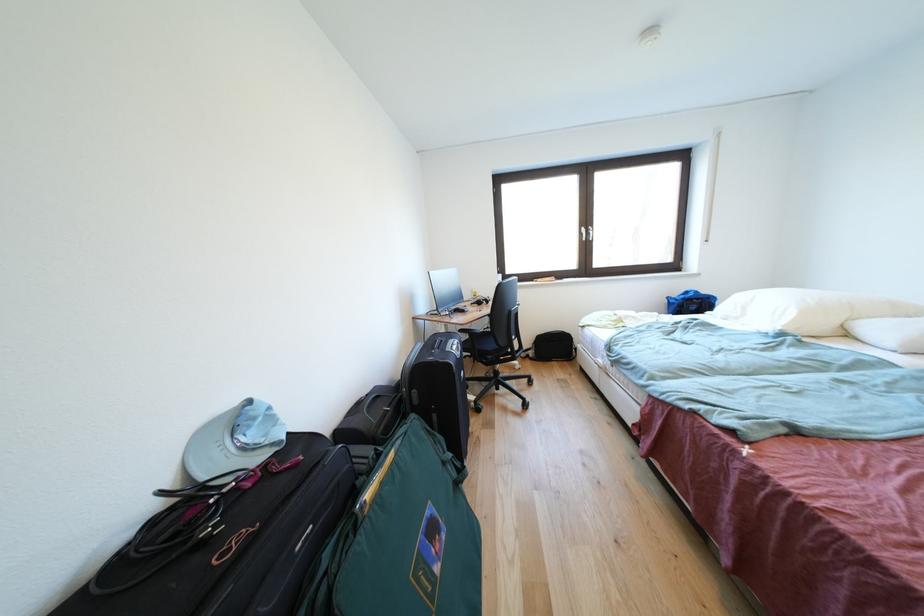
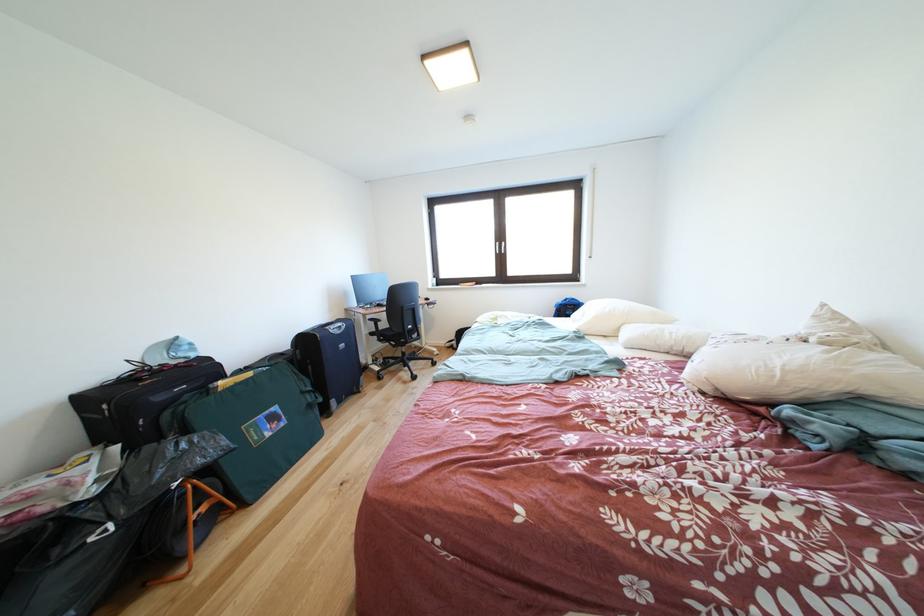
Find the pixel in the second image that matches (400,460) in the first image.

(259, 379)